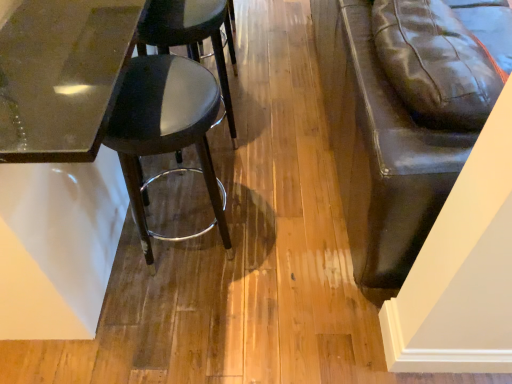
Locate an element on the screen. The height and width of the screenshot is (384, 512). free space in front of matte black stool at left, which is the first stool from bottom to top is located at coordinates (177, 326).